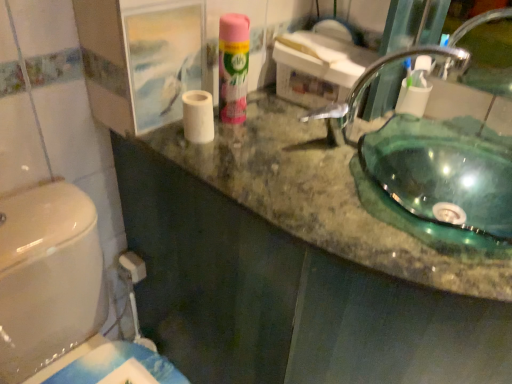
Image resolution: width=512 pixels, height=384 pixels. In order to click on free location to the left of white matte toilet paper at center, marked as the second toilet paper in a back-to-front arrangement in this screenshot , I will do `click(160, 134)`.